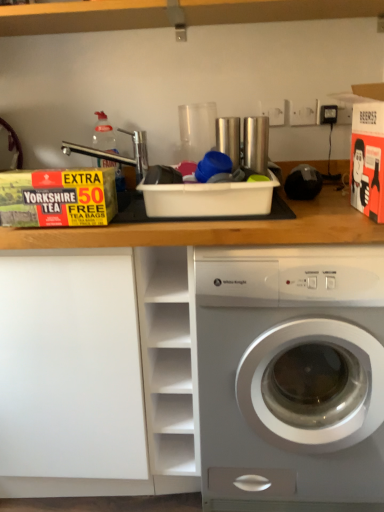
Question: Is white matte cabinet at center shorter than white glossy washing machine at center?

Choices:
 (A) yes
 (B) no

Answer: (A)

Question: From the image's perspective, is white matte cabinet at center located beneath white glossy washing machine at center?

Choices:
 (A) no
 (B) yes

Answer: (A)

Question: From the image's perspective, is white matte cabinet at center located above white glossy washing machine at center?

Choices:
 (A) yes
 (B) no

Answer: (A)

Question: Considering the relative sizes of white matte cabinet at center and white glossy washing machine at center in the image provided, is white matte cabinet at center thinner than white glossy washing machine at center?

Choices:
 (A) no
 (B) yes

Answer: (A)

Question: From a real-world perspective, is white matte cabinet at center beneath white glossy washing machine at center?

Choices:
 (A) no
 (B) yes

Answer: (A)

Question: Is white matte box at left situated inside white glossy washing machine at center or outside?

Choices:
 (A) inside
 (B) outside

Answer: (B)

Question: Considering the positions of point (129, 346) and point (369, 415), is point (129, 346) closer or farther from the camera than point (369, 415)?

Choices:
 (A) closer
 (B) farther

Answer: (B)

Question: From a real-world perspective, is white matte box at left physically located above or below white glossy washing machine at center?

Choices:
 (A) above
 (B) below

Answer: (B)

Question: Is white matte box at left in front of or behind white glossy washing machine at center in the image?

Choices:
 (A) front
 (B) behind

Answer: (B)

Question: Considering the positions of white matte cabinet at center and clear plastic bottle at upper left in the image, is white matte cabinet at center wider or thinner than clear plastic bottle at upper left?

Choices:
 (A) wide
 (B) thin

Answer: (A)

Question: Considering the positions of white matte cabinet at center and clear plastic bottle at upper left in the image, is white matte cabinet at center taller or shorter than clear plastic bottle at upper left?

Choices:
 (A) tall
 (B) short

Answer: (A)

Question: From the image's perspective, is white matte cabinet at center located above or below clear plastic bottle at upper left?

Choices:
 (A) above
 (B) below

Answer: (B)

Question: From a real-world perspective, is white matte cabinet at center physically located above or below clear plastic bottle at upper left?

Choices:
 (A) below
 (B) above

Answer: (A)

Question: In terms of width, does white matte box at left look wider or thinner when compared to clear plastic bottle at upper left?

Choices:
 (A) thin
 (B) wide

Answer: (B)

Question: From their relative heights in the image, would you say white matte box at left is taller or shorter than clear plastic bottle at upper left?

Choices:
 (A) short
 (B) tall

Answer: (B)